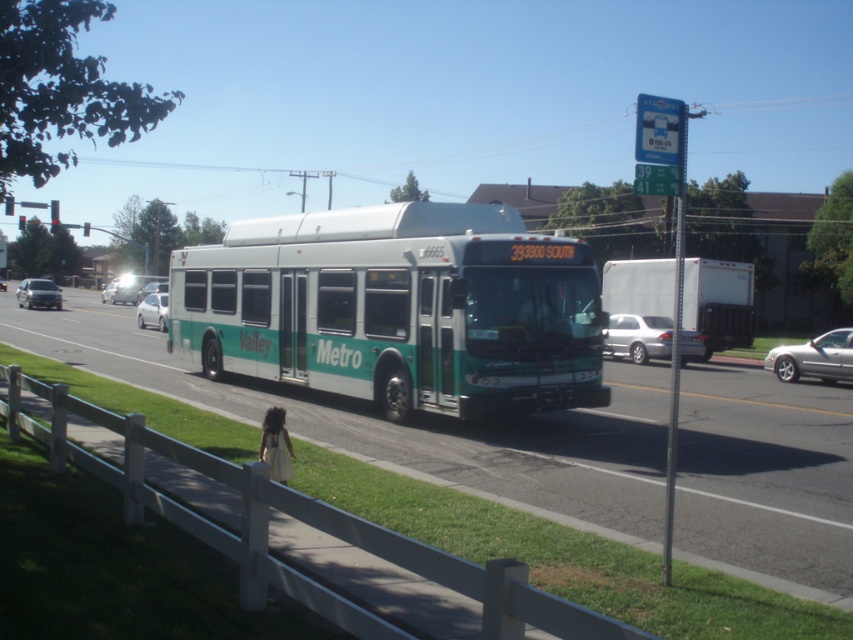
Question: Can you confirm if silver metallic sedan at center-right is thinner than white glossy sedan at center?

Choices:
 (A) no
 (B) yes

Answer: (B)

Question: Which object is farther from the camera taking this photo?

Choices:
 (A) green matte bus at center
 (B) white glossy sedan at center

Answer: (B)

Question: Which point appears farthest from the camera in this image?

Choices:
 (A) coord(798,371)
 (B) coord(390,333)
 (C) coord(4,280)

Answer: (C)

Question: Which of these objects is positioned closest to the green matte bus at center?

Choices:
 (A) silver metallic sedan at right
 (B) silver metallic sedan at left

Answer: (A)

Question: Is green matte bus at center in front of silver metallic sedan at right?

Choices:
 (A) yes
 (B) no

Answer: (A)

Question: Does green matte bus at center have a greater width compared to white glossy sedan at left?

Choices:
 (A) yes
 (B) no

Answer: (A)